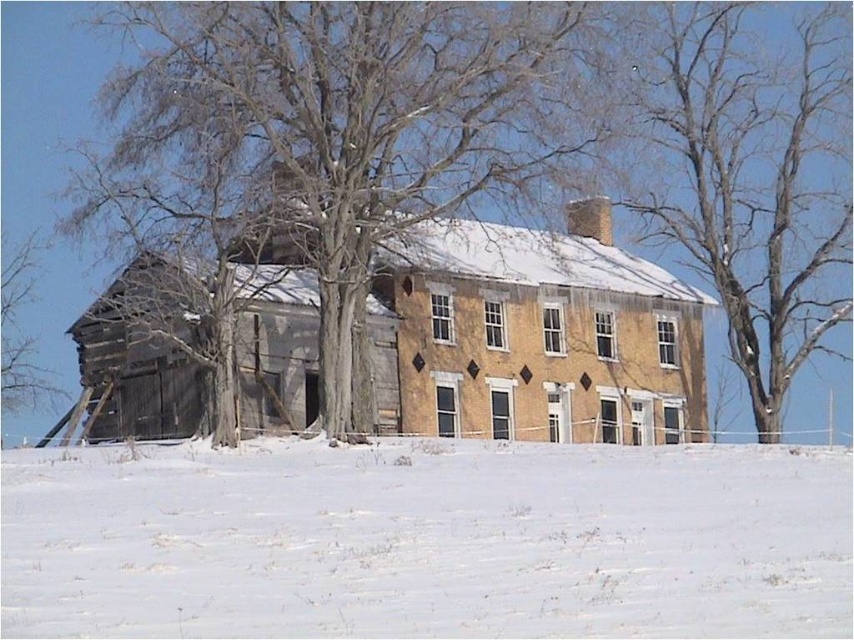
Consider the image. Is bare wood tree at center thinner than bare wood tree at upper center?

No, bare wood tree at center is not thinner than bare wood tree at upper center.

Which is below, bare wood tree at center or bare wood tree at upper center?

bare wood tree at upper center is below.

What are the coordinates of `bare wood tree at center` in the screenshot? It's located at (338, 131).

I want to click on bare wood tree at center, so click(338, 131).

Is white powdery snow at lower center thinner than bare wood tree at left?

In fact, white powdery snow at lower center might be wider than bare wood tree at left.

From the picture: Can you confirm if white powdery snow at lower center is taller than bare wood tree at left?

No.

Is point (630, 582) less distant than point (22, 344)?

Yes, point (630, 582) is closer to viewer.

The image size is (854, 640). In order to click on white powdery snow at lower center in this screenshot , I will do `click(427, 540)`.

Who is positioned more to the right, bare wood tree at center or bare wood tree at left?

bare wood tree at center

Is point (338, 193) positioned behind point (39, 365)?

No, it is in front of (39, 365).

Locate an element on the screen. The width and height of the screenshot is (854, 640). bare wood tree at center is located at coordinates (338, 131).